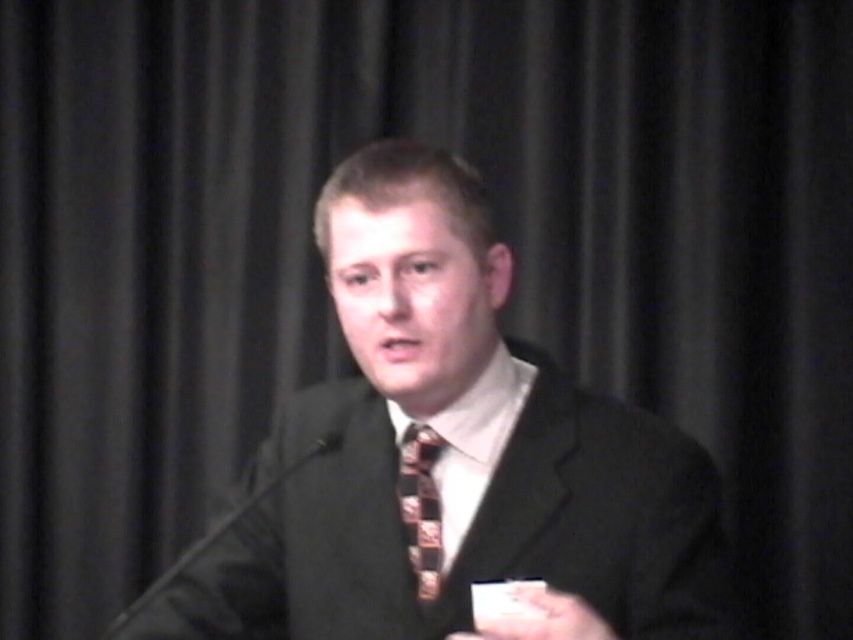
You are organizing a presentation and need to ensure that your materials are properly aligned. You have a patterned silk tie at center and a smooth white paper at center. Which object is located to the left when viewed from the front?

The patterned silk tie at center is positioned on the left side of smooth white paper at center, so when viewed from the front, the patterned silk tie at center is to the left of the smooth white paper at center.

You are organizing a charity event and need to ensure that the speaker can move comfortably while wearing his matte black suit at center and patterned silk tie at center. Considering their sizes, which item might restrict his movement more?

The matte black suit at center is larger in size than the patterned silk tie at center, so the larger matte black suit at center might restrict movement more due to its size.

You are an event planner setting up a camera for a live stream. The camera is positioned to focus on the matte black suit at center. Where should the camera be aimed to best capture the speaker?

The camera should be aimed at the coordinates point (445, 452) where the matte black suit at center is located to best capture the speaker.